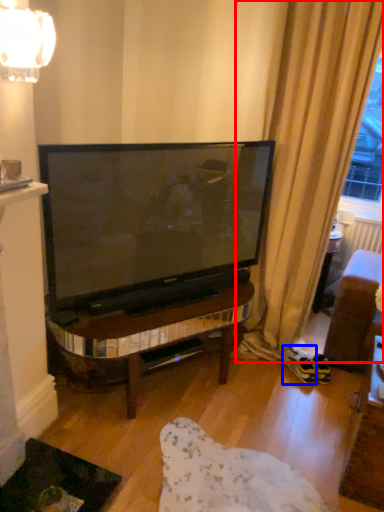
Question: Which of the following is the farthest to the observer, curtain (highlighted by a red box) or footwear (highlighted by a blue box)?

Choices:
 (A) curtain
 (B) footwear

Answer: (B)